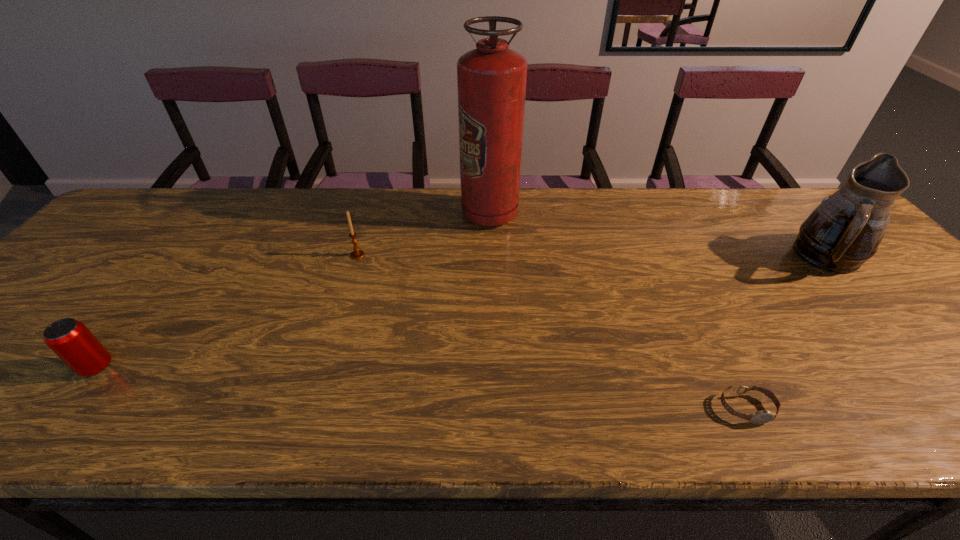
Where is `vacant region located 0.170m on the label side of the tallest object`? The width and height of the screenshot is (960, 540). vacant region located 0.170m on the label side of the tallest object is located at coordinates (405, 214).

At what (x,y) coordinates should I click in order to perform the action: click on free space located 0.140m on the label side of the tallest object. Please return your answer as a coordinate pair (x, y). The image size is (960, 540). Looking at the image, I should click on (416, 214).

Where is `free point located 0.170m from the spout of the pitcher`? free point located 0.170m from the spout of the pitcher is located at coordinates (898, 336).

The image size is (960, 540). Find the location of `free space located 0.080m on the back of the candle_holder`. free space located 0.080m on the back of the candle_holder is located at coordinates (365, 233).

Locate an element on the screen. blank space located on the back of the fourth tallest object is located at coordinates (131, 323).

The width and height of the screenshot is (960, 540). What are the coordinates of `object present at the far edge` in the screenshot? It's located at (491, 80).

You are a GUI agent. You are given a task and a screenshot of the screen. Output one action in this format:
    pyautogui.click(x=<x>, y=<y>)
    Task: Click on the object located at the near edge
    This screenshot has height=540, width=960.
    Given the screenshot: What is the action you would take?
    pyautogui.click(x=764, y=416)

Identify the location of object that is at the right edge. This screenshot has width=960, height=540. (844, 231).

I want to click on vacant space at the far edge, so click(x=731, y=192).

Image resolution: width=960 pixels, height=540 pixels. What are the coordinates of `blank space at the near edge of the desktop` in the screenshot? It's located at (825, 399).